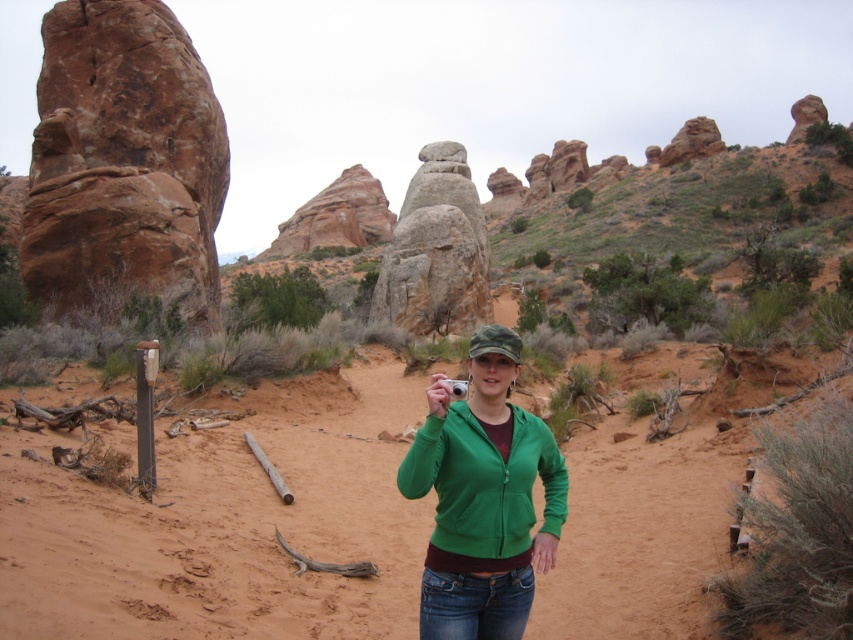
Can you confirm if sandy brown at center is taller than rustic sandstone rock formation at left?

Incorrect, sandy brown at center's height is not larger of rustic sandstone rock formation at left's.

Can you confirm if sandy brown at center is shorter than rustic sandstone rock formation at left?

Correct, sandy brown at center is not as tall as rustic sandstone rock formation at left.

Describe the element at coordinates (227, 522) in the screenshot. I see `sandy brown at center` at that location.

This screenshot has height=640, width=853. I want to click on sandy brown at center, so click(227, 522).

Which is below, rustic sandstone rock formation at left or rustic stone formation at center?

Positioned lower is rustic stone formation at center.

The image size is (853, 640). I want to click on rustic sandstone rock formation at left, so pyautogui.click(x=123, y=157).

This screenshot has width=853, height=640. What do you see at coordinates (227, 522) in the screenshot?
I see `sandy brown at center` at bounding box center [227, 522].

Between point (161, 458) and point (425, 168), which one is positioned behind?

The point (425, 168) is more distant.

Find the location of `sandy brown at center`. sandy brown at center is located at coordinates 227,522.